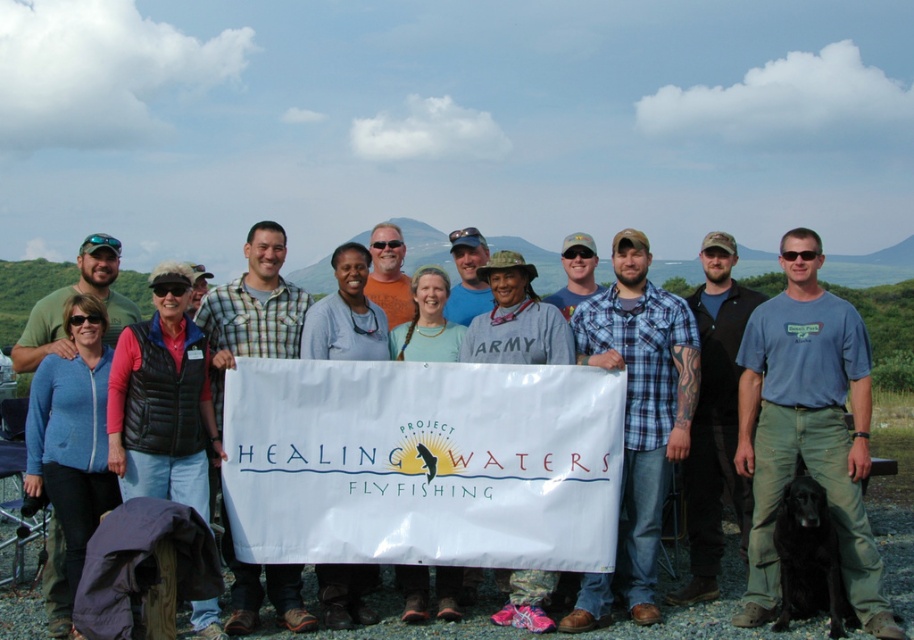
You are a photographer trying to capture a closeup of the blue plaid shirt at center and the blue fleece jacket at center. Which clothing item has a narrower width when viewed from the front?

The blue plaid shirt at center is thinner than the blue fleece jacket at center, so the blue plaid shirt at center has a narrower width when viewed from the front.